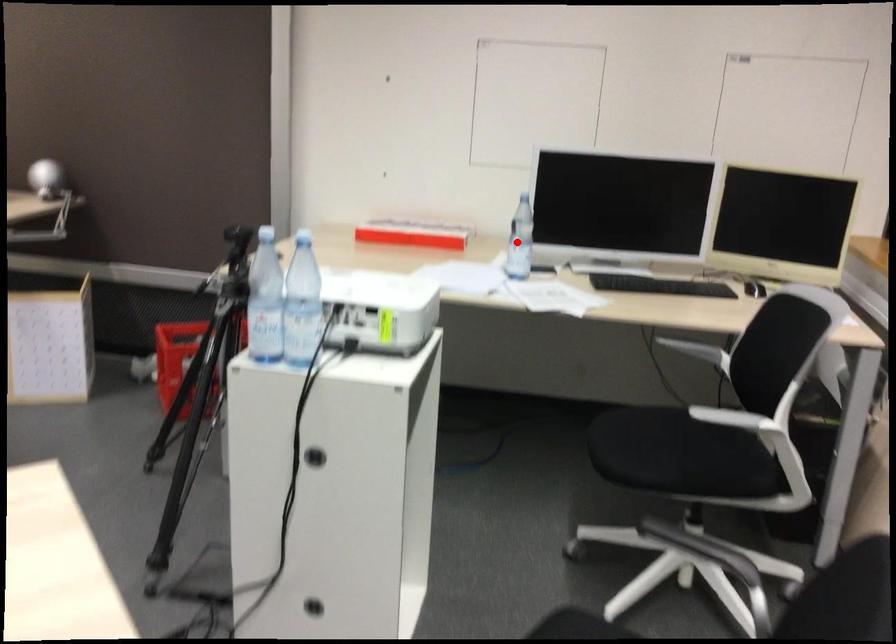
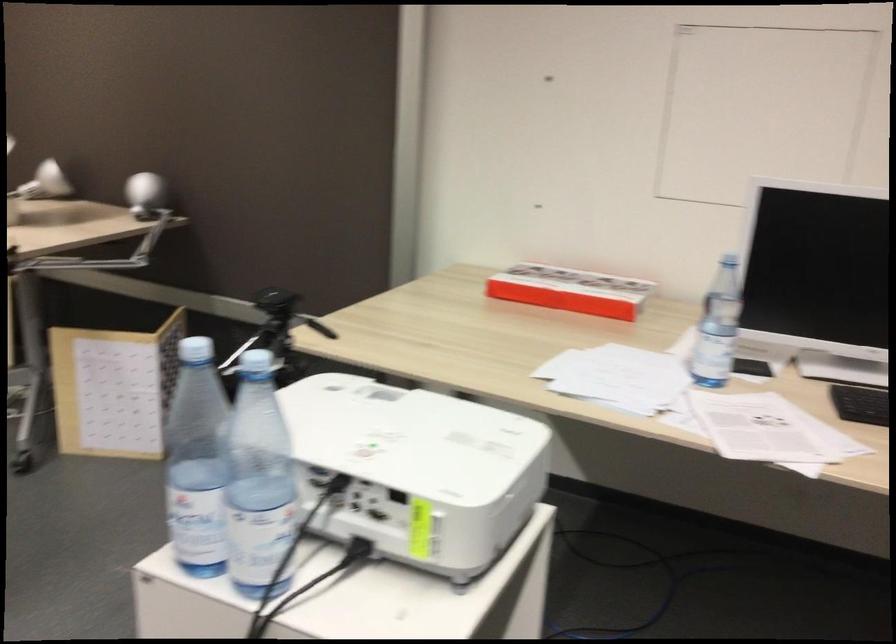
Locate, in the second image, the point that corresponds to the highlighted location in the first image.

(718, 327)